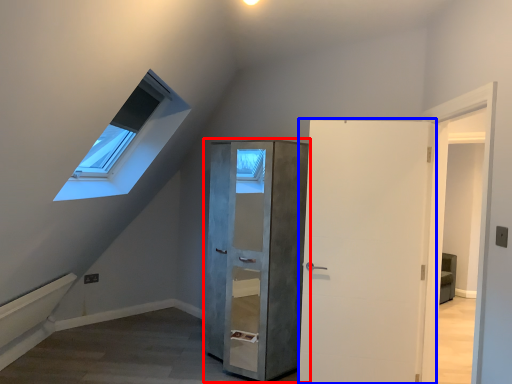
Question: Which object is further to the camera taking this photo, cupboard (highlighted by a red box) or door (highlighted by a blue box)?

Choices:
 (A) cupboard
 (B) door

Answer: (A)